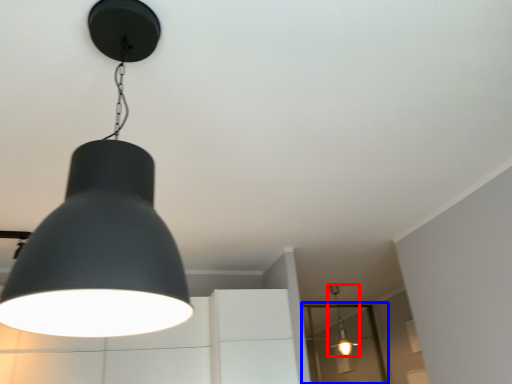
Question: Which point is further to the camera, lamp (highlighted by a red box) or glass door (highlighted by a blue box)?

Choices:
 (A) lamp
 (B) glass door

Answer: (B)